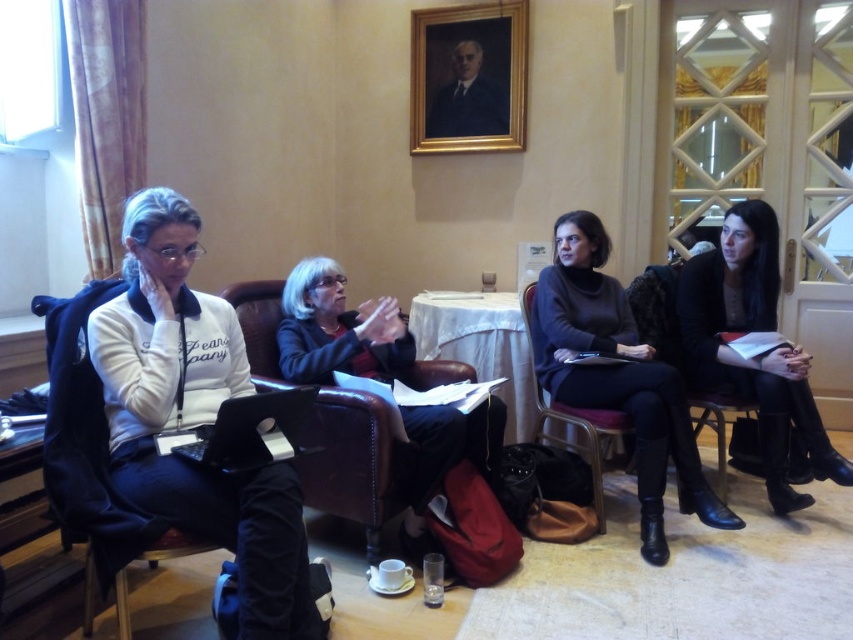
Can you confirm if black leather jacket at right is positioned to the left of metallic brown chair at center?

In fact, black leather jacket at right is to the right of metallic brown chair at center.

Which is below, black leather jacket at right or metallic brown chair at center?

Positioned lower is metallic brown chair at center.

Is point (746, 260) positioned in front of point (556, 406)?

No.

The image size is (853, 640). I want to click on black leather jacket at right, so click(x=753, y=356).

Is dark gray sweater at center closer to the viewer compared to black leather jacket at right?

Yes, it is in front of black leather jacket at right.

Is dark gray sweater at center above black leather jacket at right?

No.

Is point (548, 323) more distant than point (837, 460)?

That is True.

Locate an element on the screen. This screenshot has height=640, width=853. dark gray sweater at center is located at coordinates (618, 376).

Who is positioned more to the left, dark gray sweater at center or white cloth-covered table at center?

white cloth-covered table at center is more to the left.

Where is `dark gray sweater at center`? Image resolution: width=853 pixels, height=640 pixels. dark gray sweater at center is located at coordinates (618, 376).

Is point (683, 451) in front of point (426, 304)?

Yes, point (683, 451) is closer to viewer.

Find the location of `dark gray sweater at center`. dark gray sweater at center is located at coordinates (618, 376).